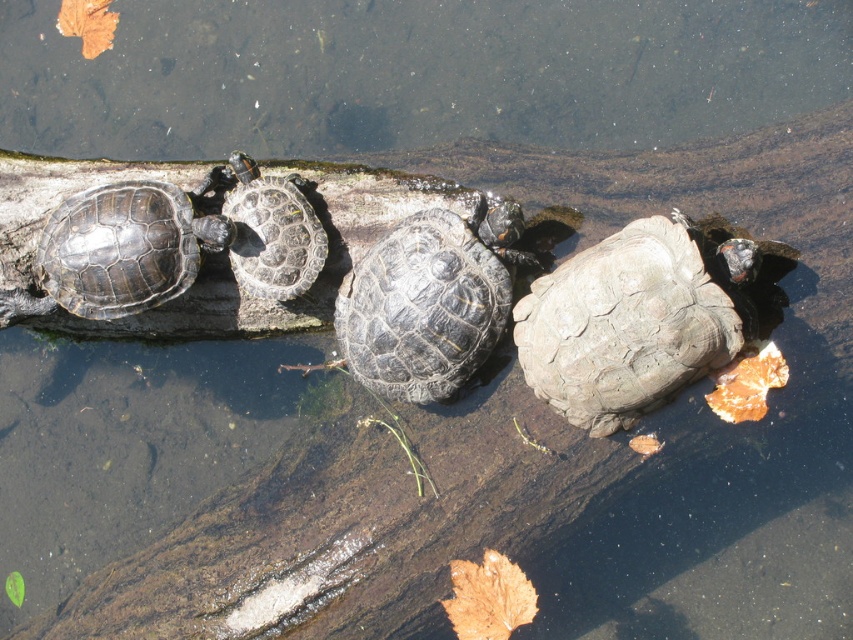
Question: Based on their relative distances, which object is farther from the smooth gray tortoise at right?

Choices:
 (A) shiny dark gray tortoise at center
 (B) dark gray textured shell at center
 (C) gray textured shell at center
 (D) shiny dark gray tortoise at left

Answer: (D)

Question: Is shiny dark gray tortoise at left to the left of shiny dark gray tortoise at center from the viewer's perspective?

Choices:
 (A) yes
 (B) no

Answer: (A)

Question: Which object appears closest to the camera in this image?

Choices:
 (A) gray textured shell at center
 (B) shiny dark gray tortoise at left
 (C) shiny dark gray tortoise at center
 (D) smooth gray tortoise at right

Answer: (A)

Question: Is dark gray textured shell at center closer to the viewer compared to shiny dark gray tortoise at center?

Choices:
 (A) no
 (B) yes

Answer: (B)

Question: Which point is closer to the camera?

Choices:
 (A) (105, 305)
 (B) (407, 355)
 (C) (231, 216)

Answer: (B)

Question: Can you confirm if gray textured shell at center is positioned to the left of dark gray textured shell at center?

Choices:
 (A) no
 (B) yes

Answer: (A)